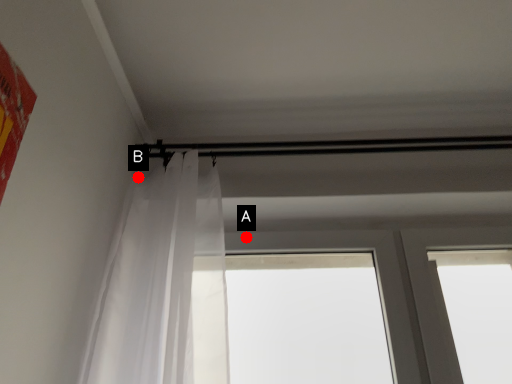
Question: Two points are circled on the image, labeled by A and B beside each circle. Which point appears closest to the camera in this image?

Choices:
 (A) A is closer
 (B) B is closer

Answer: (B)